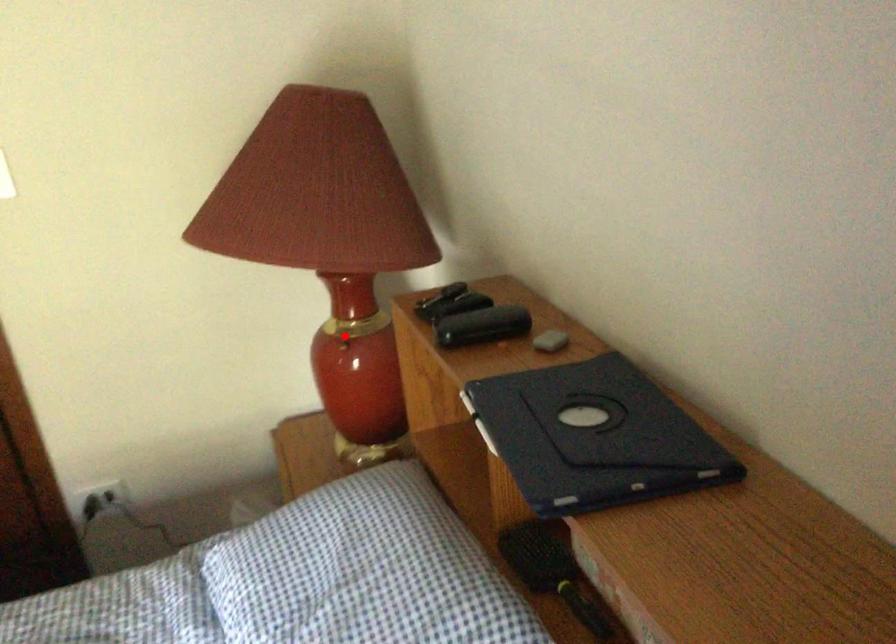
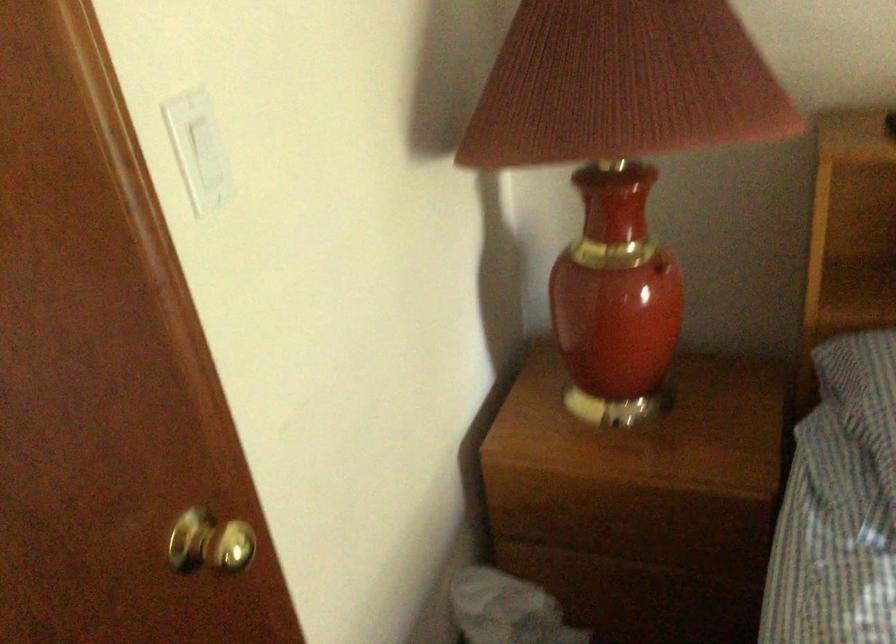
Question: I am providing you with two images of the same scene from different viewpoints. A red point is shown in image1. For the corresponding object point in image2, is it positioned nearer or farther from the camera?

Choices:
 (A) Nearer
 (B) Farther

Answer: (A)